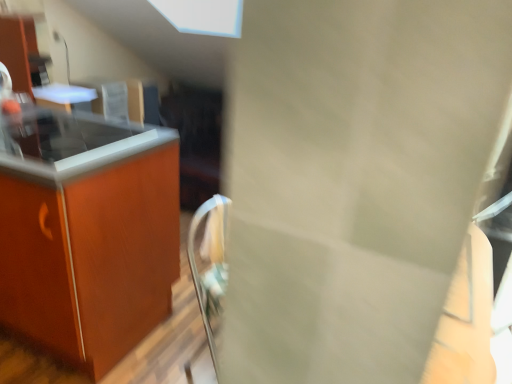
Find the location of a particular element. smooth glass countertop at left, acting as the second countertop starting from the bottom is located at coordinates (70, 143).

Measure the distance between smooth glass countertop at left, acting as the second countertop starting from the bottom, and camera.

smooth glass countertop at left, acting as the second countertop starting from the bottom, and camera are 4.27 feet apart.

Describe the element at coordinates (70, 143) in the screenshot. I see `smooth glass countertop at left, acting as the second countertop starting from the bottom` at that location.

Image resolution: width=512 pixels, height=384 pixels. I want to click on matte wood countertop at left, acting as the first countertop starting from the bottom, so click(x=86, y=232).

How much space does matte wood countertop at left, acting as the first countertop starting from the bottom, occupy horizontally?

matte wood countertop at left, acting as the first countertop starting from the bottom, is 24.62 inches in width.

What do you see at coordinates (86, 232) in the screenshot?
I see `matte wood countertop at left, acting as the first countertop starting from the bottom` at bounding box center [86, 232].

The width and height of the screenshot is (512, 384). I want to click on smooth glass countertop at left, acting as the second countertop starting from the bottom, so click(x=70, y=143).

Is smooth glass countertop at left, which appears as the 1th countertop when viewed from the top, to the left or to the right of matte wood countertop at left, acting as the first countertop starting from the bottom, in the image?

smooth glass countertop at left, which appears as the 1th countertop when viewed from the top, is positioned on matte wood countertop at left, acting as the first countertop starting from the bottom,'s right side.

Is smooth glass countertop at left, acting as the second countertop starting from the bottom, closer to camera compared to matte wood countertop at left, the second countertop in the top-to-bottom sequence?

No.

Does point (93, 140) appear closer or farther from the camera than point (47, 167)?

Point (93, 140) appears to be farther away from the viewer than point (47, 167).

From the image's perspective, relative to matte wood countertop at left, acting as the first countertop starting from the bottom, is smooth glass countertop at left, which appears as the 1th countertop when viewed from the top, above or below?

Clearly, from the image's perspective, smooth glass countertop at left, which appears as the 1th countertop when viewed from the top, is above matte wood countertop at left, acting as the first countertop starting from the bottom.

Looking at this image, from a real-world perspective, who is located higher, smooth glass countertop at left, acting as the second countertop starting from the bottom, or matte wood countertop at left, acting as the first countertop starting from the bottom?

From a 3D spatial view, smooth glass countertop at left, acting as the second countertop starting from the bottom, is above.

Which object is thinner, smooth glass countertop at left, which appears as the 1th countertop when viewed from the top, or matte wood countertop at left, the second countertop in the top-to-bottom sequence?

smooth glass countertop at left, which appears as the 1th countertop when viewed from the top.

Can you confirm if smooth glass countertop at left, acting as the second countertop starting from the bottom, is taller than matte wood countertop at left, the second countertop in the top-to-bottom sequence?

Incorrect, the height of smooth glass countertop at left, acting as the second countertop starting from the bottom, is not larger of that of matte wood countertop at left, the second countertop in the top-to-bottom sequence.

Between smooth glass countertop at left, which appears as the 1th countertop when viewed from the top, and matte wood countertop at left, the second countertop in the top-to-bottom sequence, which one has smaller size?

With smaller size is smooth glass countertop at left, which appears as the 1th countertop when viewed from the top.

Is matte wood countertop at left, the second countertop in the top-to-bottom sequence, surrounded by smooth glass countertop at left, which appears as the 1th countertop when viewed from the top?

No, smooth glass countertop at left, which appears as the 1th countertop when viewed from the top, does not contain matte wood countertop at left, the second countertop in the top-to-bottom sequence.

Is smooth glass countertop at left, which appears as the 1th countertop when viewed from the top, beside matte wood countertop at left, the second countertop in the top-to-bottom sequence?

smooth glass countertop at left, which appears as the 1th countertop when viewed from the top, and matte wood countertop at left, the second countertop in the top-to-bottom sequence, are clearly separated.

Is smooth glass countertop at left, acting as the second countertop starting from the bottom, facing away from matte wood countertop at left, the second countertop in the top-to-bottom sequence?

Yes, smooth glass countertop at left, acting as the second countertop starting from the bottom,'s orientation is away from matte wood countertop at left, the second countertop in the top-to-bottom sequence.

Locate an element on the screen. The height and width of the screenshot is (384, 512). countertop located in front of the smooth glass countertop at left, acting as the second countertop starting from the bottom is located at coordinates (86, 232).

Looking at this image, is matte wood countertop at left, the second countertop in the top-to-bottom sequence, at the left side of smooth glass countertop at left, which appears as the 1th countertop when viewed from the top?

Indeed, matte wood countertop at left, the second countertop in the top-to-bottom sequence, is positioned on the left side of smooth glass countertop at left, which appears as the 1th countertop when viewed from the top.

Is the depth of matte wood countertop at left, acting as the first countertop starting from the bottom, less than that of smooth glass countertop at left, which appears as the 1th countertop when viewed from the top?

Yes, it is in front of smooth glass countertop at left, which appears as the 1th countertop when viewed from the top.

Which is in front, point (88, 315) or point (25, 115)?

The point (88, 315) is closer.

From the image's perspective, is matte wood countertop at left, acting as the first countertop starting from the bottom, beneath smooth glass countertop at left, which appears as the 1th countertop when viewed from the top?

Correct, matte wood countertop at left, acting as the first countertop starting from the bottom, appears lower than smooth glass countertop at left, which appears as the 1th countertop when viewed from the top, in the image.

From a real-world perspective, is matte wood countertop at left, the second countertop in the top-to-bottom sequence, over smooth glass countertop at left, acting as the second countertop starting from the bottom?

Actually, matte wood countertop at left, the second countertop in the top-to-bottom sequence, is physically below smooth glass countertop at left, acting as the second countertop starting from the bottom, in the real world.

Considering the sizes of objects matte wood countertop at left, the second countertop in the top-to-bottom sequence, and smooth glass countertop at left, acting as the second countertop starting from the bottom, in the image provided, who is wider, matte wood countertop at left, the second countertop in the top-to-bottom sequence, or smooth glass countertop at left, acting as the second countertop starting from the bottom,?

Wider between the two is matte wood countertop at left, the second countertop in the top-to-bottom sequence.

Does matte wood countertop at left, the second countertop in the top-to-bottom sequence, have a lesser height compared to smooth glass countertop at left, acting as the second countertop starting from the bottom?

Incorrect, the height of matte wood countertop at left, the second countertop in the top-to-bottom sequence, does not fall short of that of smooth glass countertop at left, acting as the second countertop starting from the bottom.

Considering the sizes of matte wood countertop at left, the second countertop in the top-to-bottom sequence, and smooth glass countertop at left, acting as the second countertop starting from the bottom, in the image, is matte wood countertop at left, the second countertop in the top-to-bottom sequence, bigger or smaller than smooth glass countertop at left, acting as the second countertop starting from the bottom,?

In the image, matte wood countertop at left, the second countertop in the top-to-bottom sequence, appears to be larger than smooth glass countertop at left, acting as the second countertop starting from the bottom.

Is matte wood countertop at left, the second countertop in the top-to-bottom sequence, spatially inside smooth glass countertop at left, acting as the second countertop starting from the bottom, or outside of it?

matte wood countertop at left, the second countertop in the top-to-bottom sequence, is outside smooth glass countertop at left, acting as the second countertop starting from the bottom.

Are matte wood countertop at left, acting as the first countertop starting from the bottom, and smooth glass countertop at left, which appears as the 1th countertop when viewed from the top, beside each other?

There is a gap between matte wood countertop at left, acting as the first countertop starting from the bottom, and smooth glass countertop at left, which appears as the 1th countertop when viewed from the top.

Is matte wood countertop at left, the second countertop in the top-to-bottom sequence, turned away from smooth glass countertop at left, which appears as the 1th countertop when viewed from the top?

No, matte wood countertop at left, the second countertop in the top-to-bottom sequence, is not facing the opposite direction of smooth glass countertop at left, which appears as the 1th countertop when viewed from the top.

How many degrees apart are the facing directions of matte wood countertop at left, acting as the first countertop starting from the bottom, and smooth glass countertop at left, which appears as the 1th countertop when viewed from the top?

The angle between the facing direction of matte wood countertop at left, acting as the first countertop starting from the bottom, and the facing direction of smooth glass countertop at left, which appears as the 1th countertop when viewed from the top, is 0.61 degrees.

How distant is matte wood countertop at left, acting as the first countertop starting from the bottom, from smooth glass countertop at left, which appears as the 1th countertop when viewed from the top?

The distance of matte wood countertop at left, acting as the first countertop starting from the bottom, from smooth glass countertop at left, which appears as the 1th countertop when viewed from the top, is 9.02 inches.

Locate an element on the screen. This screenshot has width=512, height=384. countertop that appears on the right of matte wood countertop at left, the second countertop in the top-to-bottom sequence is located at coordinates click(70, 143).

At what (x,y) coordinates should I click in order to perform the action: click on countertop that is under the smooth glass countertop at left, which appears as the 1th countertop when viewed from the top (from a real-world perspective). Please return your answer as a coordinate pair (x, y). The height and width of the screenshot is (384, 512). Looking at the image, I should click on (86, 232).

This screenshot has width=512, height=384. What are the coordinates of `countertop lying above the matte wood countertop at left, the second countertop in the top-to-bottom sequence (from the image's perspective)` in the screenshot? It's located at (70, 143).